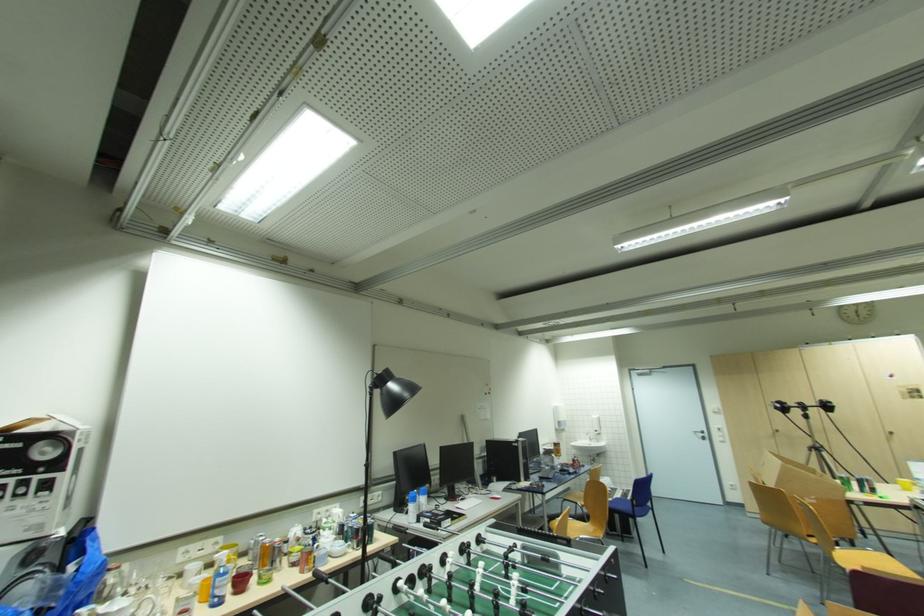
The width and height of the screenshot is (924, 616). What do you see at coordinates (146, 606) in the screenshot?
I see `the sink faucet handle` at bounding box center [146, 606].